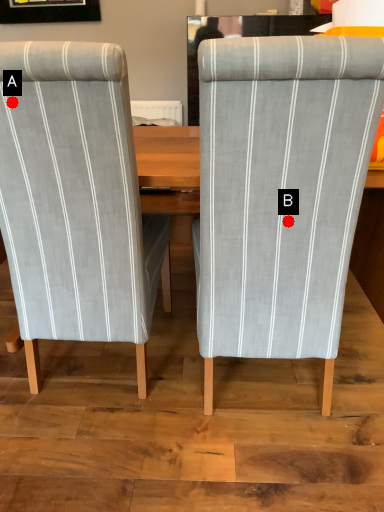
Question: Two points are circled on the image, labeled by A and B beside each circle. Which point is closer to the camera?

Choices:
 (A) A is closer
 (B) B is closer

Answer: (A)